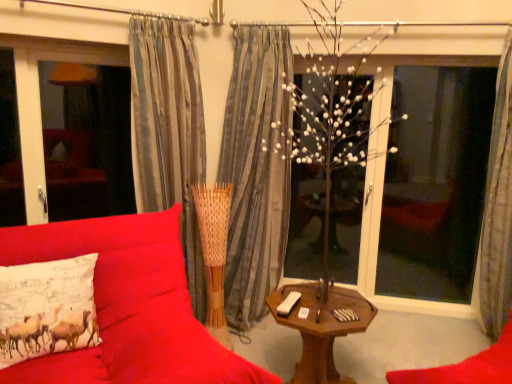
Question: Considering the relative positions of white printed pillow at left and matte glass window screen at left, placed as the 2th window screen when sorted from right to left, in the image provided, is white printed pillow at left to the left or to the right of matte glass window screen at left, placed as the 2th window screen when sorted from right to left,?

Choices:
 (A) right
 (B) left

Answer: (A)

Question: Is white printed pillow at left bigger or smaller than matte glass window screen at left, the first window screen in the left-to-right sequence?

Choices:
 (A) small
 (B) big

Answer: (A)

Question: Based on their relative distances, which object is farther from the gray striped curtain at right, arranged as the first curtain when viewed from the right?

Choices:
 (A) striped fabric curtain at center, the 2th curtain positioned from the right
 (B) wooden table at center
 (C) transparent glass window at right, which ranks as the 2th window screen in left-to-right order
 (D) white printed pillow at left
 (E) matte glass window screen at left, placed as the 2th window screen when sorted from right to left

Answer: (E)

Question: Considering the real-world distances, which object is closest to the wooden table at center?

Choices:
 (A) transparent glass window at right, the first window screen in the right-to-left sequence
 (B) velvet red couch at center
 (C) white printed pillow at left
 (D) gray striped curtain at right, arranged as the first curtain when viewed from the right
 (E) matte glass window screen at left, placed as the 2th window screen when sorted from right to left

Answer: (B)